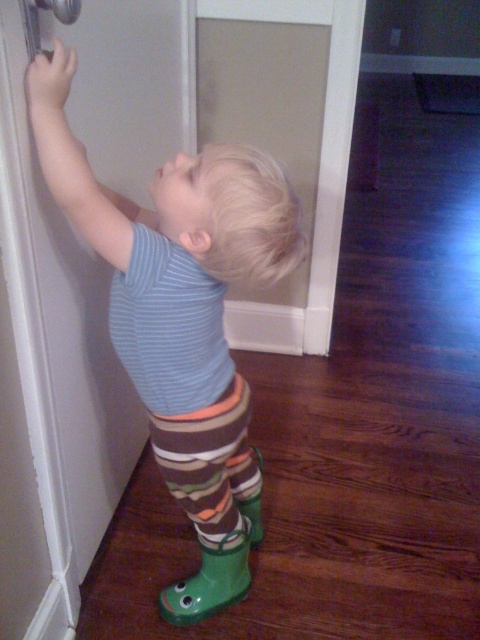
Question: Which is nearer to the green rubber boots at lower left?

Choices:
 (A) metallic silver door handle at upper left
 (B) green rubber boot at lower right

Answer: (B)

Question: Observing the image, what is the correct spatial positioning of green rubber boots at lower left in reference to green rubber boot at lower right?

Choices:
 (A) right
 (B) left

Answer: (A)

Question: Based on their relative distances, which object is nearer to the green rubber boot at lower right?

Choices:
 (A) metallic silver door handle at upper left
 (B) green rubber boots at lower left

Answer: (B)

Question: Does green rubber boot at lower right have a smaller size compared to metallic silver door handle at upper left?

Choices:
 (A) yes
 (B) no

Answer: (B)

Question: Which object appears farthest from the camera in this image?

Choices:
 (A) metallic silver door handle at upper left
 (B) green rubber boots at lower left
 (C) green rubber boot at lower right

Answer: (C)

Question: Does green rubber boots at lower left appear over green rubber boot at lower right?

Choices:
 (A) no
 (B) yes

Answer: (B)